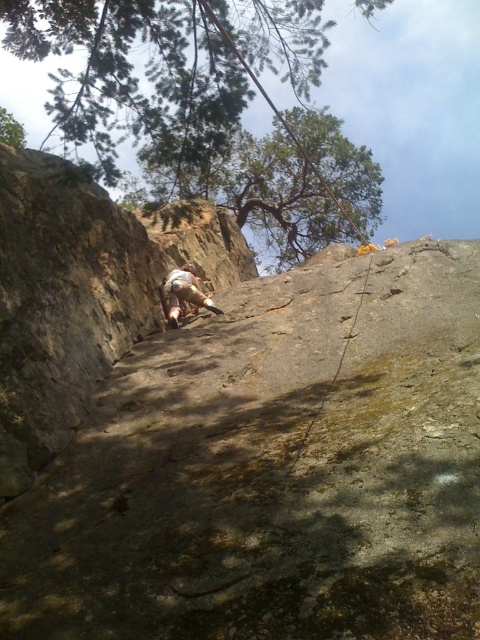
Question: Can you confirm if green leafy tree at upper left is positioned to the left of tan fabric pants at center?

Choices:
 (A) yes
 (B) no

Answer: (A)

Question: Is green leafy tree at upper left to the left of tan fabric pants at center from the viewer's perspective?

Choices:
 (A) yes
 (B) no

Answer: (A)

Question: Is green leafy tree at upper left positioned before tan fabric pants at center?

Choices:
 (A) no
 (B) yes

Answer: (B)